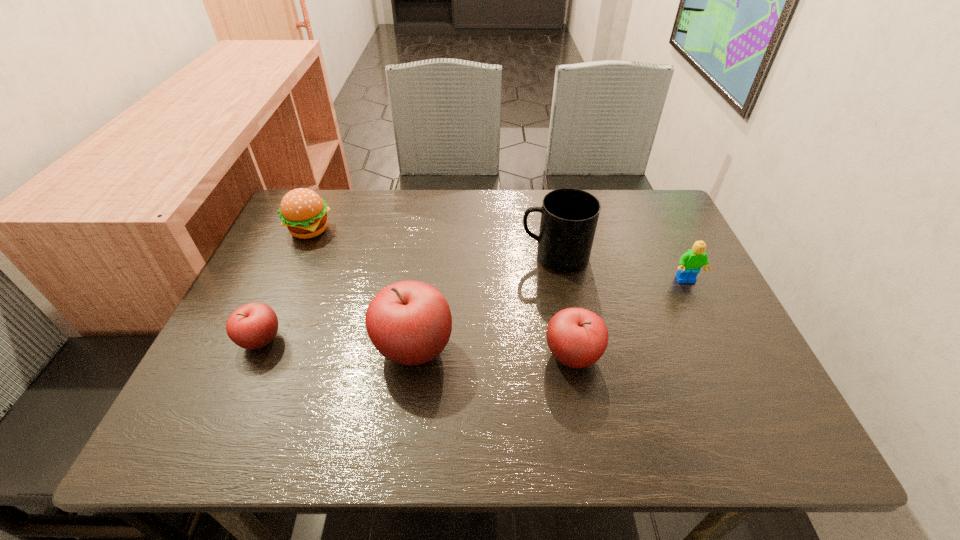
What are the coordinates of `apple that is the closest to the rightmost object` in the screenshot? It's located at (577, 338).

Find the location of `the third closest apple relative to the fourth nearest object`. the third closest apple relative to the fourth nearest object is located at coordinates (252, 326).